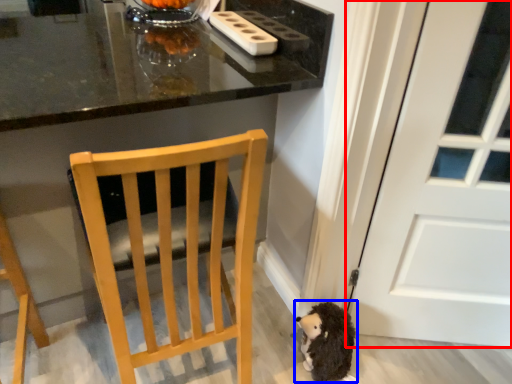
Question: Among these objects, which one is nearest to the camera, door (highlighted by a red box) or toy (highlighted by a blue box)?

Choices:
 (A) door
 (B) toy

Answer: (A)